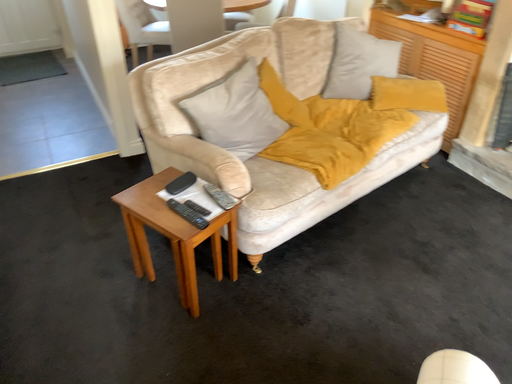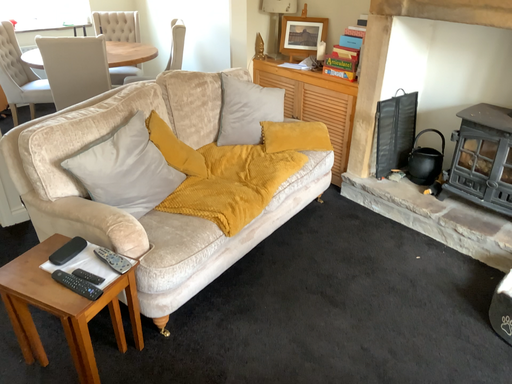
Question: Which way did the camera rotate in the video?

Choices:
 (A) rotated left
 (B) rotated right

Answer: (B)